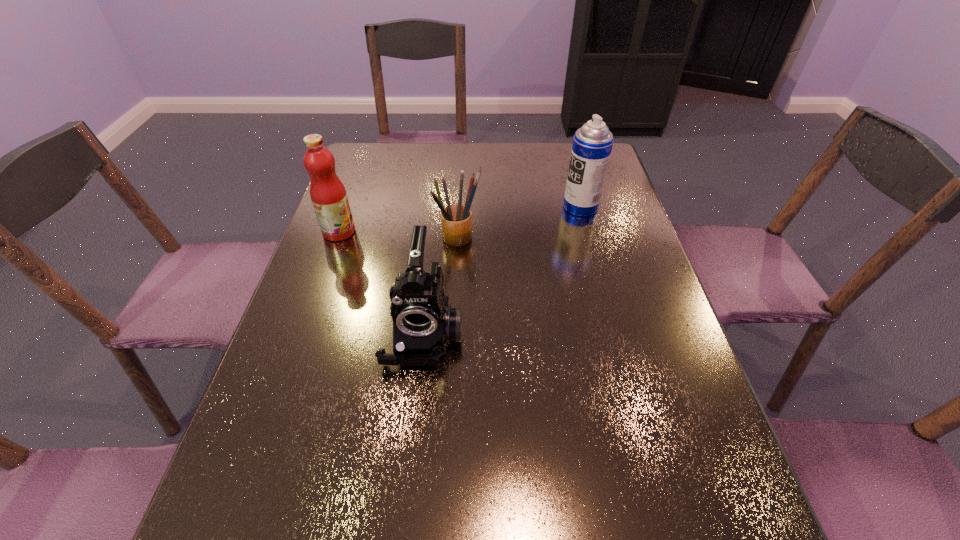
The height and width of the screenshot is (540, 960). I want to click on the leftmost object, so click(x=328, y=195).

Locate an element on the screen. This screenshot has width=960, height=540. aerosol can is located at coordinates (592, 144).

Identify the location of the farthest object. (592, 144).

The width and height of the screenshot is (960, 540). Identify the location of the nearest object. (424, 323).

Where is `pencil box`? pencil box is located at coordinates (456, 219).

At what (x,y) coordinates should I click in order to perform the action: click on free space located on the front label of the fruit juice. Please return your answer as a coordinate pair (x, y). Image resolution: width=960 pixels, height=540 pixels. Looking at the image, I should click on (417, 232).

Where is `free space located on the label side of the farthest object`? The image size is (960, 540). free space located on the label side of the farthest object is located at coordinates (444, 207).

At what (x,y) coordinates should I click in order to perform the action: click on vacant space located on the label side of the farthest object. Please return your answer as a coordinate pair (x, y). The width and height of the screenshot is (960, 540). Looking at the image, I should click on (536, 207).

At what (x,y) coordinates should I click in order to perform the action: click on vacant space situated 0.110m on the label side of the farthest object. Please return your answer as a coordinate pair (x, y). The height and width of the screenshot is (540, 960). Looking at the image, I should click on (526, 207).

At what (x,y) coordinates should I click in order to perform the action: click on vacant position located 0.070m on the lens mount of the camcorder. Please return your answer as a coordinate pair (x, y). The width and height of the screenshot is (960, 540). Looking at the image, I should click on (416, 402).